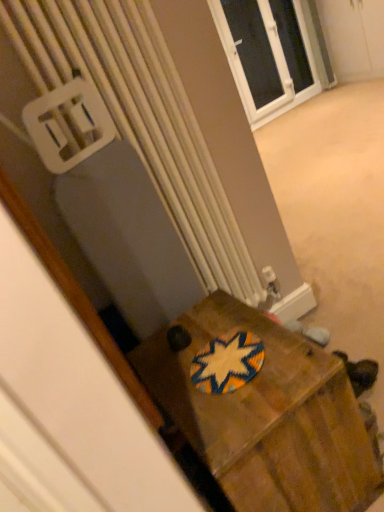
Question: Relative to wooden box at center, is white plastic radiator at center in front or behind?

Choices:
 (A) behind
 (B) front

Answer: (A)

Question: Looking at the image, does white plastic radiator at center seem bigger or smaller compared to wooden box at center?

Choices:
 (A) big
 (B) small

Answer: (B)

Question: Estimate the real-world distances between objects in this image. Which object is farther from the woven fabric coaster at center?

Choices:
 (A) white plastic radiator at center
 (B) wooden box at center
 (C) white plastic window at upper center

Answer: (C)

Question: Estimate the real-world distances between objects in this image. Which object is closer to the wooden box at center?

Choices:
 (A) white plastic radiator at center
 (B) white plastic window at upper center
 (C) woven fabric coaster at center

Answer: (C)